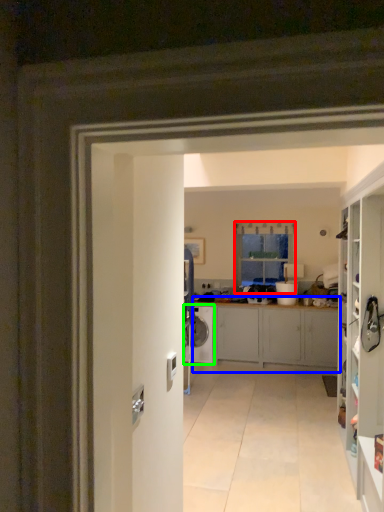
Question: Which object is positioned farthest from window (highlighted by a red box)? Select from cabinetry (highlighted by a blue box) and washing machine (highlighted by a green box).

Choices:
 (A) cabinetry
 (B) washing machine

Answer: (B)